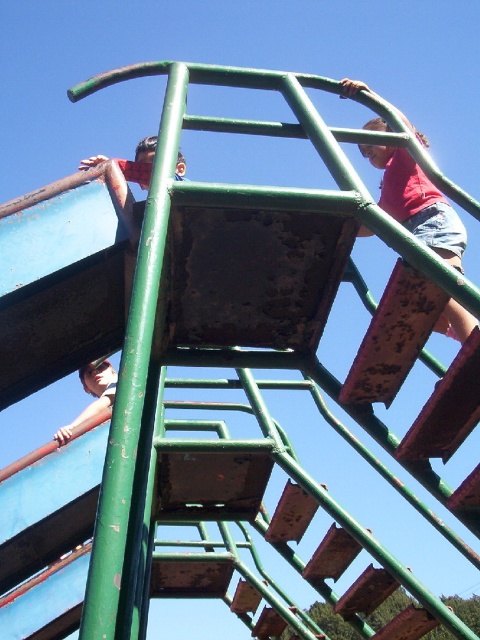
Question: Is matte red shirt at upper right to the left of matte green ladder at lower left from the viewer's perspective?

Choices:
 (A) no
 (B) yes

Answer: (A)

Question: Which point is farther to the camera?

Choices:
 (A) (91, 387)
 (B) (367, 88)

Answer: (A)

Question: Where is matte red shirt at upper right located in relation to matte green ladder at lower left in the image?

Choices:
 (A) right
 (B) left

Answer: (A)

Question: Which point is closer to the camera taking this photo?

Choices:
 (A) (437, 227)
 (B) (73, 428)

Answer: (A)

Question: Can you confirm if matte red shirt at upper right is positioned below matte green ladder at lower left?

Choices:
 (A) no
 (B) yes

Answer: (A)

Question: Among these objects, which one is nearest to the camera?

Choices:
 (A) matte green ladder at lower left
 (B) matte red shirt at upper right

Answer: (B)